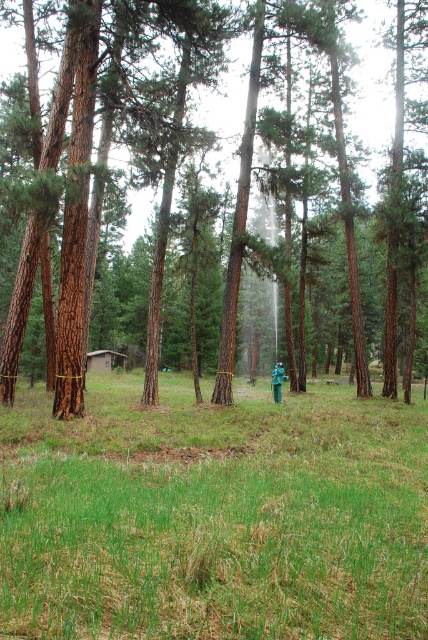
Which is more to the left, green grass at center or brown rough tree at center?

brown rough tree at center is more to the left.

From the picture: Is green grass at center closer to the viewer compared to brown rough tree at center?

Yes.

Describe the element at coordinates (214, 513) in the screenshot. The height and width of the screenshot is (640, 428). I see `green grass at center` at that location.

Where is `green grass at center`? green grass at center is located at coordinates (214, 513).